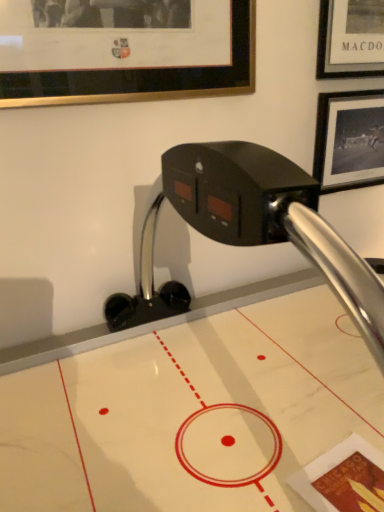
Where is `white marble air hockey table at center`? Image resolution: width=384 pixels, height=512 pixels. white marble air hockey table at center is located at coordinates (190, 412).

Describe the element at coordinates (123, 50) in the screenshot. The width and height of the screenshot is (384, 512). I see `gold-framed picture at upper left, the 1th picture frame from the left` at that location.

Identify the location of white marble air hockey table at center. This screenshot has height=512, width=384. (190, 412).

Who is smaller, gold-framed picture at upper left, acting as the 2th picture frame starting from the right, or black matte picture frame at upper right, the 2th picture frame in the left-to-right sequence?

With smaller size is gold-framed picture at upper left, acting as the 2th picture frame starting from the right.

Does gold-framed picture at upper left, which is counted as the 1th picture frame, starting from the front, appear on the left side of black matte picture frame at upper right, the 2th picture frame in the left-to-right sequence?

Yes, gold-framed picture at upper left, which is counted as the 1th picture frame, starting from the front, is to the left of black matte picture frame at upper right, the 2th picture frame in the left-to-right sequence.

Is gold-framed picture at upper left, the 1th picture frame from the left, inside the boundaries of black matte picture frame at upper right, placed as the 1th picture frame when sorted from right to left, or outside?

gold-framed picture at upper left, the 1th picture frame from the left, lies outside black matte picture frame at upper right, placed as the 1th picture frame when sorted from right to left.

Can you see gold-framed picture at upper left, which is counted as the 1th picture frame, starting from the front, touching black matte picture frame at upper right, the 2th picture frame in the left-to-right sequence?

No, gold-framed picture at upper left, which is counted as the 1th picture frame, starting from the front, is not touching black matte picture frame at upper right, the 2th picture frame in the left-to-right sequence.

Considering the relative sizes of gold-framed picture at upper left, acting as the 2th picture frame starting from the right, and white marble air hockey table at center in the image provided, is gold-framed picture at upper left, acting as the 2th picture frame starting from the right, taller than white marble air hockey table at center?

No, gold-framed picture at upper left, acting as the 2th picture frame starting from the right, is not taller than white marble air hockey table at center.

Which point is more forward, (1, 37) or (148, 390)?

Point (1, 37)

Which object is positioned more to the left, gold-framed picture at upper left, the second picture frame positioned from the back, or white marble air hockey table at center?

Positioned to the left is gold-framed picture at upper left, the second picture frame positioned from the back.

Where is `picture frame that is above the black matte picture frame at upper right, placed as the 1th picture frame when sorted from right to left (from a real-world perspective)`? Image resolution: width=384 pixels, height=512 pixels. picture frame that is above the black matte picture frame at upper right, placed as the 1th picture frame when sorted from right to left (from a real-world perspective) is located at coordinates (123, 50).

Is there a large distance between black matte picture frame at upper right, the 2th picture frame viewed from the front, and gold-framed picture at upper left, the second picture frame positioned from the back?

That's not correct — black matte picture frame at upper right, the 2th picture frame viewed from the front, is a little close to gold-framed picture at upper left, the second picture frame positioned from the back.

From a real-world perspective, is black matte picture frame at upper right, the 2th picture frame viewed from the front, beneath gold-framed picture at upper left, the second picture frame positioned from the back?

Yes, from a real-world perspective, black matte picture frame at upper right, the 2th picture frame viewed from the front, is under gold-framed picture at upper left, the second picture frame positioned from the back.

Is black matte picture frame at upper right, the first picture frame from the back, spatially inside gold-framed picture at upper left, the 1th picture frame from the left, or outside of it?

black matte picture frame at upper right, the first picture frame from the back, is spatially situated outside gold-framed picture at upper left, the 1th picture frame from the left.

From a real-world perspective, is white marble air hockey table at center positioned above or below black matte picture frame at upper right, the 2th picture frame in the left-to-right sequence?

white marble air hockey table at center is below black matte picture frame at upper right, the 2th picture frame in the left-to-right sequence.

Considering the relative sizes of white marble air hockey table at center and black matte picture frame at upper right, the first picture frame from the back, in the image provided, is white marble air hockey table at center bigger than black matte picture frame at upper right, the first picture frame from the back,?

Indeed, white marble air hockey table at center has a larger size compared to black matte picture frame at upper right, the first picture frame from the back.

Which is behind, point (324, 343) or point (359, 157)?

The point (359, 157) is farther.

Is white marble air hockey table at center taller than black matte picture frame at upper right, the 2th picture frame in the left-to-right sequence?

Indeed, white marble air hockey table at center has a greater height compared to black matte picture frame at upper right, the 2th picture frame in the left-to-right sequence.

Is black matte picture frame at upper right, the 2th picture frame in the left-to-right sequence, located outside white marble air hockey table at center?

No, most part of black matte picture frame at upper right, the 2th picture frame in the left-to-right sequence, lies within white marble air hockey table at center.

Is point (324, 144) less distant than point (26, 474)?

No, (324, 144) is behind (26, 474).

Can you tell me how much black matte picture frame at upper right, the 2th picture frame viewed from the front, and white marble air hockey table at center differ in facing direction?

The angle between the facing direction of black matte picture frame at upper right, the 2th picture frame viewed from the front, and the facing direction of white marble air hockey table at center is 0.373 degrees.

Does point (98, 397) appear closer or farther from the camera than point (81, 32)?

Point (98, 397) is positioned closer to the camera compared to point (81, 32).

Does white marble air hockey table at center turn towards gold-framed picture at upper left, the second picture frame positioned from the back?

No, white marble air hockey table at center is not oriented towards gold-framed picture at upper left, the second picture frame positioned from the back.

How different are the orientations of white marble air hockey table at center and gold-framed picture at upper left, the second picture frame positioned from the back, in degrees?

They differ by 0.368 degrees in their facing directions.

From the image's perspective, which is below, white marble air hockey table at center or gold-framed picture at upper left, acting as the 2th picture frame starting from the right?

white marble air hockey table at center appears lower in the image.

Identify the location of picture frame in front of the black matte picture frame at upper right, the 2th picture frame in the left-to-right sequence. The height and width of the screenshot is (512, 384). (123, 50).

Locate an element on the screen. The height and width of the screenshot is (512, 384). table located on the right of gold-framed picture at upper left, which is counted as the 1th picture frame, starting from the front is located at coordinates (190, 412).

From the image, which object appears to be nearer to black matte picture frame at upper right, the first picture frame from the back, gold-framed picture at upper left, acting as the 2th picture frame starting from the right, or white marble air hockey table at center?

gold-framed picture at upper left, acting as the 2th picture frame starting from the right, lies closer to black matte picture frame at upper right, the first picture frame from the back, than the other object.

When comparing their distances from white marble air hockey table at center, does black matte picture frame at upper right, the 2th picture frame in the left-to-right sequence, or gold-framed picture at upper left, the second picture frame positioned from the back, seem closer?

black matte picture frame at upper right, the 2th picture frame in the left-to-right sequence, is closer to white marble air hockey table at center.

Looking at the image, which one is located further to white marble air hockey table at center, gold-framed picture at upper left, the 1th picture frame from the left, or black matte picture frame at upper right, the first picture frame from the back?

The object further to white marble air hockey table at center is gold-framed picture at upper left, the 1th picture frame from the left.

Based on the photo, from the image, which object appears to be nearer to gold-framed picture at upper left, the second picture frame positioned from the back, black matte picture frame at upper right, the 2th picture frame in the left-to-right sequence, or white marble air hockey table at center?

black matte picture frame at upper right, the 2th picture frame in the left-to-right sequence, is closer to gold-framed picture at upper left, the second picture frame positioned from the back.

Based on their spatial positions, is white marble air hockey table at center or gold-framed picture at upper left, acting as the 2th picture frame starting from the right, further from black matte picture frame at upper right, placed as the 1th picture frame when sorted from right to left?

white marble air hockey table at center is further to black matte picture frame at upper right, placed as the 1th picture frame when sorted from right to left.

Considering their positions, is white marble air hockey table at center positioned closer to gold-framed picture at upper left, the second picture frame positioned from the back, than black matte picture frame at upper right, the first picture frame from the back?

black matte picture frame at upper right, the first picture frame from the back, lies closer to gold-framed picture at upper left, the second picture frame positioned from the back, than the other object.

The image size is (384, 512). In order to click on picture frame between white marble air hockey table at center and black matte picture frame at upper right, the first picture frame from the back, from front to back in this screenshot , I will do `click(123, 50)`.